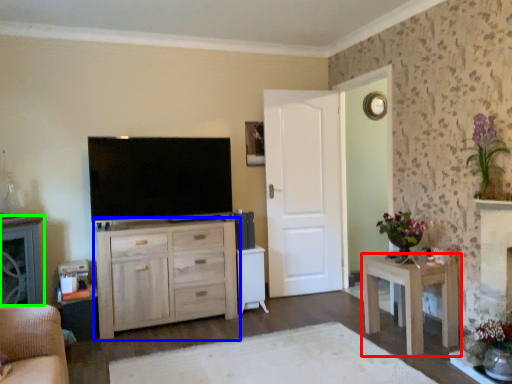
Question: Which is nearer to the nightstand (highlighted by a red box)? chest of drawers (highlighted by a blue box) or cabinetry (highlighted by a green box).

Choices:
 (A) chest of drawers
 (B) cabinetry

Answer: (A)